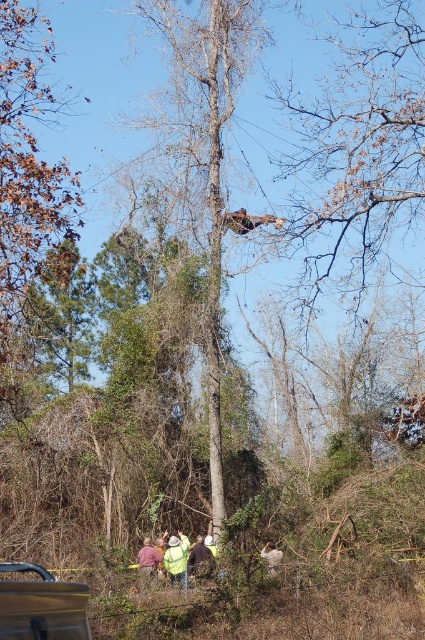
Question: Does brown wood tree at upper left have a greater width compared to metallic gray car at lower left?

Choices:
 (A) yes
 (B) no

Answer: (B)

Question: Based on their relative distances, which object is nearer to the bare wood tree at center?

Choices:
 (A) yellow fabric shirt at center
 (B) metallic gray car at lower left

Answer: (A)

Question: Which point is closer to the camera?

Choices:
 (A) (0, 284)
 (B) (252, 26)

Answer: (A)

Question: Which is nearer to the metallic gray car at lower left?

Choices:
 (A) yellow fabric shirt at center
 (B) brown wood tree at upper left

Answer: (B)

Question: Is the position of brown wood tree at upper left more distant than that of metallic gray car at lower left?

Choices:
 (A) no
 (B) yes

Answer: (B)

Question: Is brown wood tree at upper left to the right of metallic gray car at lower left from the viewer's perspective?

Choices:
 (A) no
 (B) yes

Answer: (A)